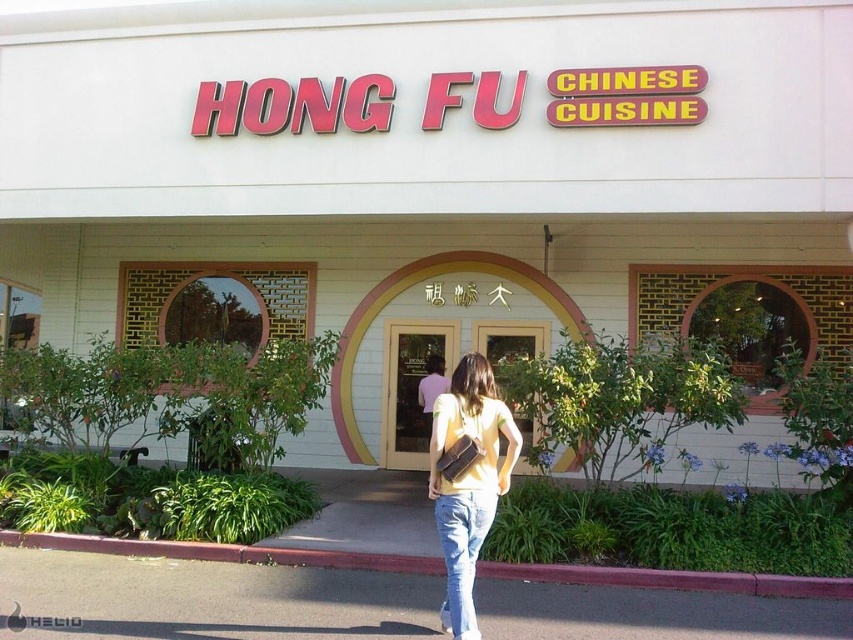
From the picture: Is gray asphalt at lower center to the right of jeans at center from the viewer's perspective?

In fact, gray asphalt at lower center is to the left of jeans at center.

Does point (144, 608) lie in front of point (473, 634)?

No, it is not.

The height and width of the screenshot is (640, 853). I want to click on gray asphalt at lower center, so click(206, 600).

In the scene shown: Can you confirm if gray asphalt at lower center is shorter than yellow matte shirt at center?

Correct, gray asphalt at lower center is not as tall as yellow matte shirt at center.

Which is more to the left, gray asphalt at lower center or yellow matte shirt at center?

gray asphalt at lower center

What do you see at coordinates (206, 600) in the screenshot?
I see `gray asphalt at lower center` at bounding box center [206, 600].

This screenshot has height=640, width=853. In order to click on gray asphalt at lower center in this screenshot , I will do `click(206, 600)`.

Can you confirm if yellow matte shirt at center is positioned above jeans at center?

Indeed, yellow matte shirt at center is positioned over jeans at center.

Who is positioned more to the left, yellow matte shirt at center or jeans at center?

jeans at center

Where is `yellow matte shirt at center`? Image resolution: width=853 pixels, height=640 pixels. yellow matte shirt at center is located at coordinates (468, 481).

Where is `yellow matte shirt at center`? yellow matte shirt at center is located at coordinates (468, 481).